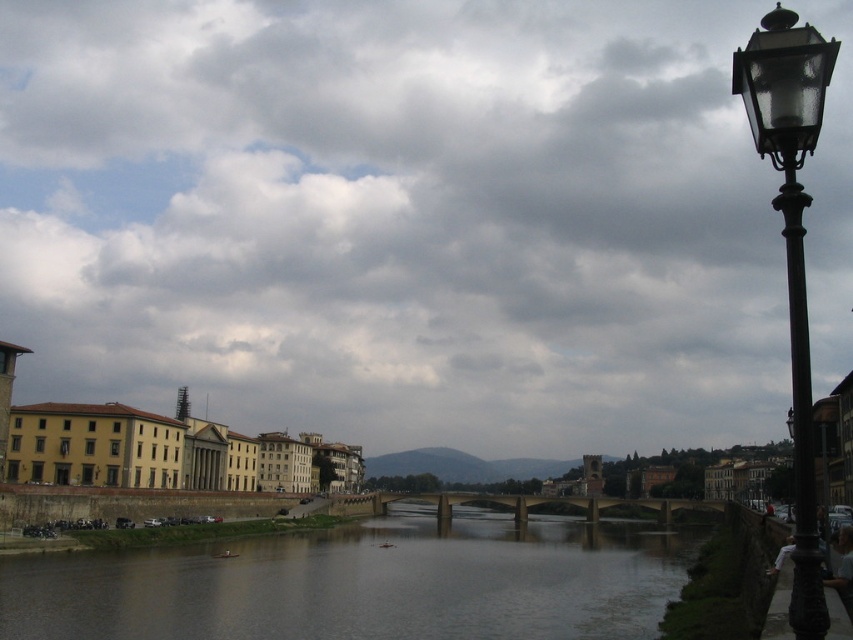
Question: Is brown concrete river at center behind polished brass lamp post at right?

Choices:
 (A) no
 (B) yes

Answer: (B)

Question: Which point is farther from the camera taking this photo?

Choices:
 (A) (506, 621)
 (B) (788, 300)

Answer: (B)

Question: Does brown concrete river at center appear on the left side of polished brass lamp post at right?

Choices:
 (A) yes
 (B) no

Answer: (A)

Question: Which point appears closest to the camera in this image?

Choices:
 (A) (566, 528)
 (B) (770, 92)

Answer: (B)

Question: Is the position of brown concrete river at center less distant than that of polished brass lamp post at right?

Choices:
 (A) no
 (B) yes

Answer: (A)